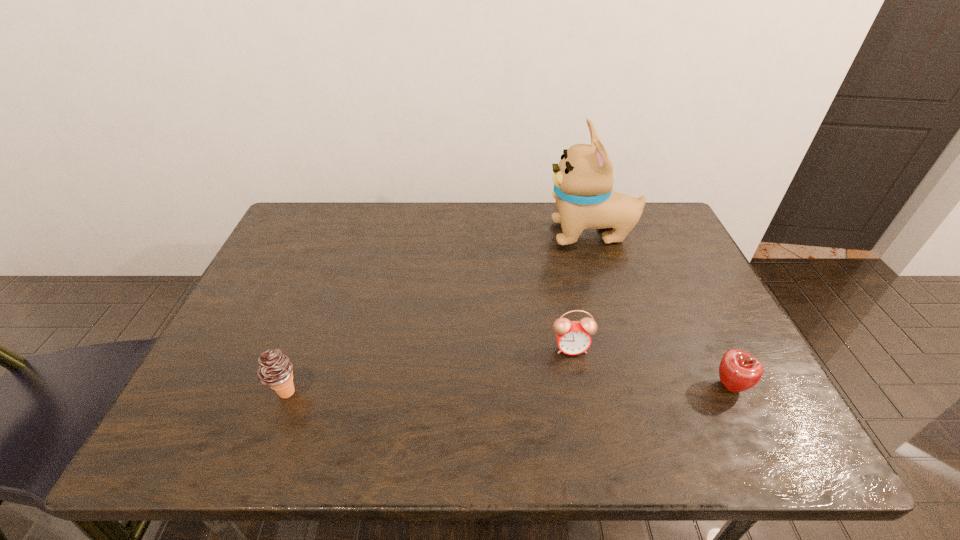
Identify the location of the tallest object. (583, 180).

The image size is (960, 540). Find the location of `puppy`. puppy is located at coordinates (583, 180).

The height and width of the screenshot is (540, 960). Find the location of `the leftmost object`. the leftmost object is located at coordinates (275, 368).

Locate an element on the screen. Image resolution: width=960 pixels, height=540 pixels. icecream is located at coordinates (275, 368).

You are a GUI agent. You are given a task and a screenshot of the screen. Output one action in this format:
    pyautogui.click(x=<x>, y=<y>)
    Task: Click on the alarm clock
    
    Given the screenshot: What is the action you would take?
    pyautogui.click(x=573, y=338)

You are a GUI agent. You are given a task and a screenshot of the screen. Output one action in this format:
    pyautogui.click(x=<x>, y=<y>)
    Task: Click on the second farthest object
    The height and width of the screenshot is (540, 960).
    Given the screenshot: What is the action you would take?
    pyautogui.click(x=573, y=338)

The height and width of the screenshot is (540, 960). Find the location of `the rightmost object`. the rightmost object is located at coordinates (738, 370).

Where is `the shortest object`? Image resolution: width=960 pixels, height=540 pixels. the shortest object is located at coordinates (738, 370).

This screenshot has width=960, height=540. In order to click on free point located 0.260m on the face of the tallest object in this screenshot , I will do [461, 234].

Find the location of a particular element. This screenshot has height=540, width=960. free region located on the face of the tallest object is located at coordinates (431, 234).